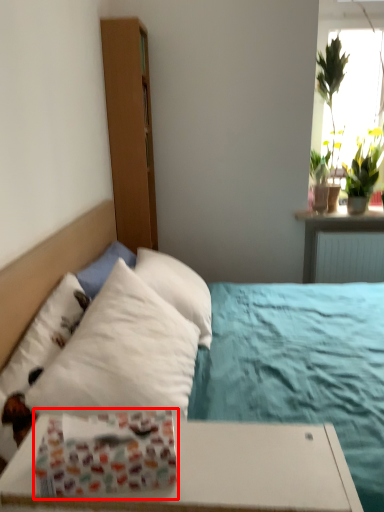
Question: Considering the relative positions of gift wrap (annotated by the red box) and bed in the image provided, where is gift wrap (annotated by the red box) located with respect to the staircase?

Choices:
 (A) right
 (B) left

Answer: (A)